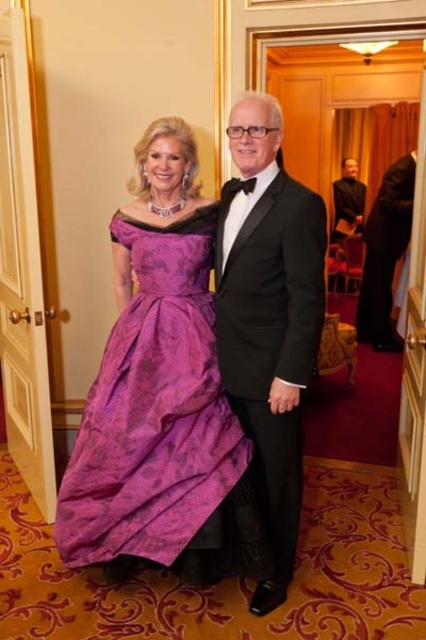
You are a photographer at a gala event. You need to position two guests for a photo. The guests are wearing the black satin tuxedo at center and the black satin suit at right. To ensure both are fully visible in the frame, which guest should be moved forward or backward? Explain your reasoning based on their current positions.

The black satin tuxedo at center is currently in front of the black satin suit at right. To ensure both are fully visible, the black satin suit at right should be moved slightly backward so that the black satin tuxedo at center remains in front without blocking the view of the other guest.

You are a photographer at a gala event. You need to decide which of the two men in black satin attire is closer to the camera. The men are wearing a black satin tuxedo at center and a black satin suit at right. Based on their clothing size in the photo, which one is nearer?

The black satin tuxedo at center has a smaller size compared to the black satin suit at right, so the black satin tuxedo at center is closer to the camera because objects closer to the viewer appear smaller in the image.